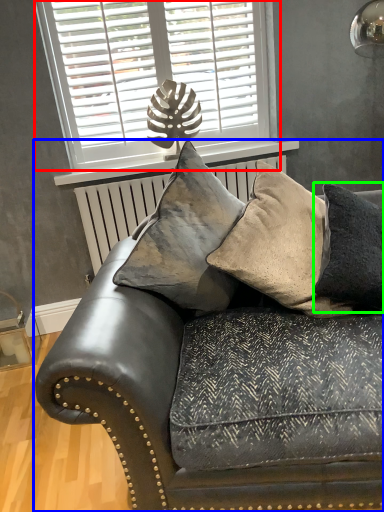
Question: Which is farther away from window (highlighted by a red box)? studio couch (highlighted by a blue box) or pillow (highlighted by a green box)?

Choices:
 (A) studio couch
 (B) pillow

Answer: (A)